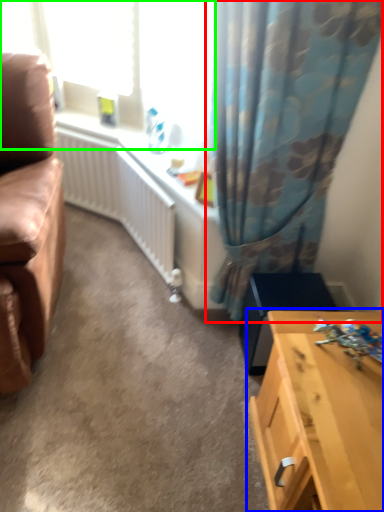
Question: Based on their relative distances, which object is nearer to curtain (highlighted by a red box)? Choose from table (highlighted by a blue box) and window screen (highlighted by a green box).

Choices:
 (A) table
 (B) window screen

Answer: (B)